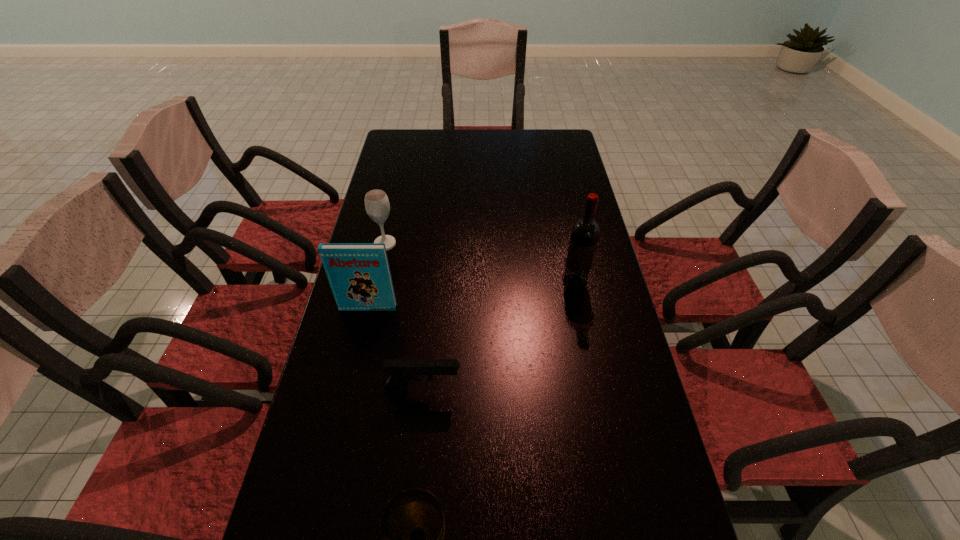
Locate an element on the screen. the fourth nearest object is located at coordinates (585, 232).

Locate an element on the screen. This screenshot has width=960, height=540. the tallest object is located at coordinates (585, 232).

Locate an element on the screen. The width and height of the screenshot is (960, 540). the fourth shortest object is located at coordinates (359, 274).

Identify the location of the third farthest object. Image resolution: width=960 pixels, height=540 pixels. (359, 274).

Where is `the third shortest object`? This screenshot has width=960, height=540. the third shortest object is located at coordinates 377,205.

Where is `wineglass`? Image resolution: width=960 pixels, height=540 pixels. wineglass is located at coordinates (377, 205).

What are the coordinates of `the shortest object` in the screenshot? It's located at (402, 371).

Where is `pistol`? The height and width of the screenshot is (540, 960). pistol is located at coordinates (402, 371).

Image resolution: width=960 pixels, height=540 pixels. Identify the location of free space located 0.050m on the front of the wine bottle. pos(580,304).

Locate an element on the screen. This screenshot has height=540, width=960. blank area located on the front cover of the second tallest object is located at coordinates (348, 399).